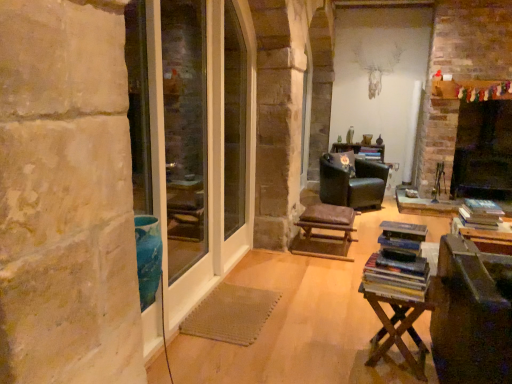
Image resolution: width=512 pixels, height=384 pixels. I want to click on vacant space underneath brown leather stool at center (from a real-world perspective), so click(329, 254).